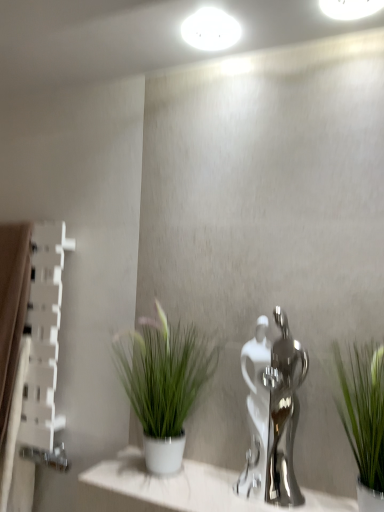
Where is `vacant space that is in between green matte plant at center, the second houseplant positioned from the front, and polished chrome faucet at center`? The width and height of the screenshot is (384, 512). vacant space that is in between green matte plant at center, the second houseplant positioned from the front, and polished chrome faucet at center is located at coordinates (230, 492).